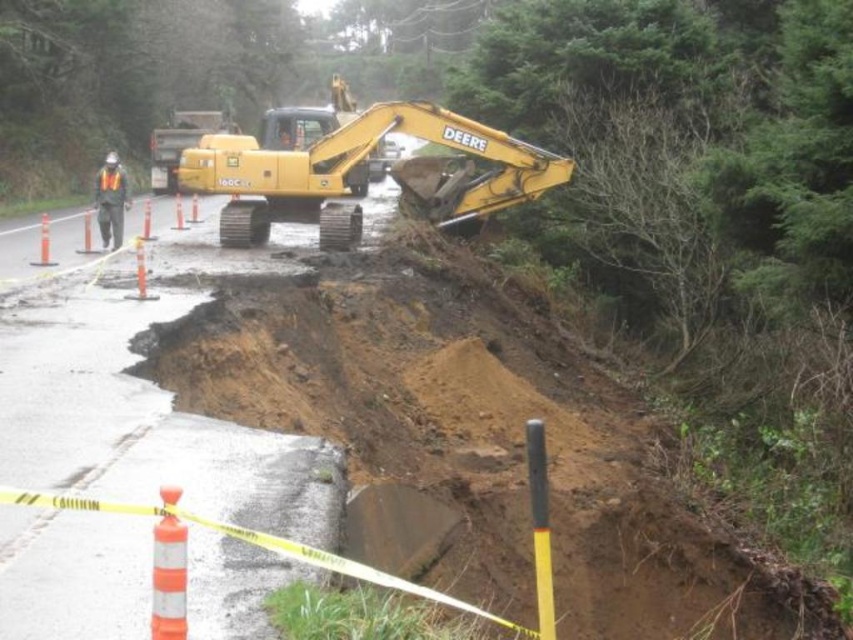
Question: Which object appears closest to the camera in this image?

Choices:
 (A) yellow rubber excavator at center
 (B) orange reflective vest at left

Answer: (A)

Question: Is yellow rubber excavator at center in front of orange reflective vest at left?

Choices:
 (A) yes
 (B) no

Answer: (A)

Question: Does yellow rubber excavator at center lie behind orange reflective vest at left?

Choices:
 (A) no
 (B) yes

Answer: (A)

Question: Can you confirm if yellow rubber excavator at center is positioned above orange reflective vest at left?

Choices:
 (A) no
 (B) yes

Answer: (A)

Question: Which point is closer to the camera?

Choices:
 (A) (219, 173)
 (B) (113, 248)

Answer: (B)